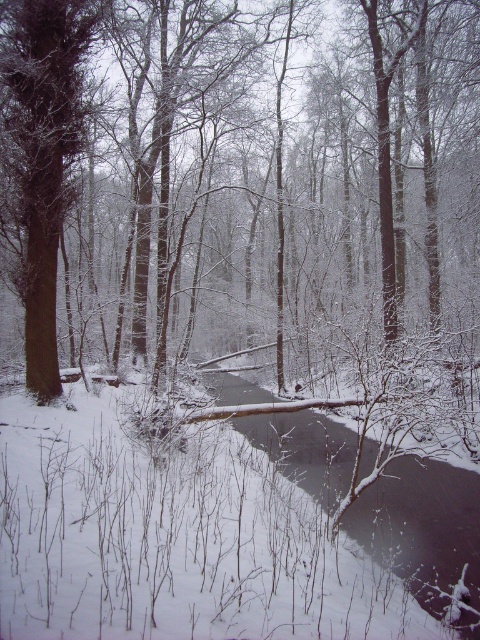
Based on the photo, which is below, brown smooth tree at center or brown rough tree at left?

Positioned lower is brown smooth tree at center.

Does point (162, 76) lie in front of point (36, 317)?

No, (162, 76) is behind (36, 317).

Locate an element on the screen. This screenshot has width=480, height=640. brown smooth tree at center is located at coordinates (240, 168).